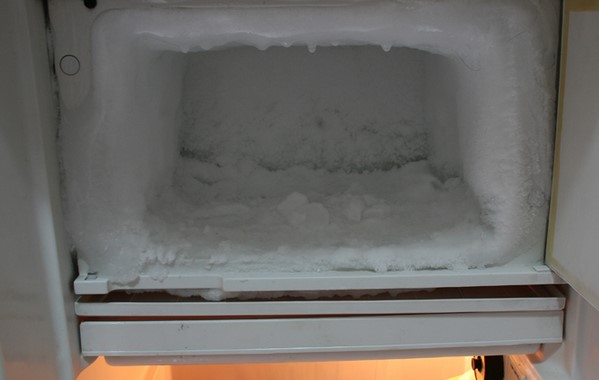
At what (x,y) coordinates should I click in order to perform the action: click on white tray. Please return your answer as a coordinate pair (x, y). The image size is (599, 380). Looking at the image, I should click on point(251,336).